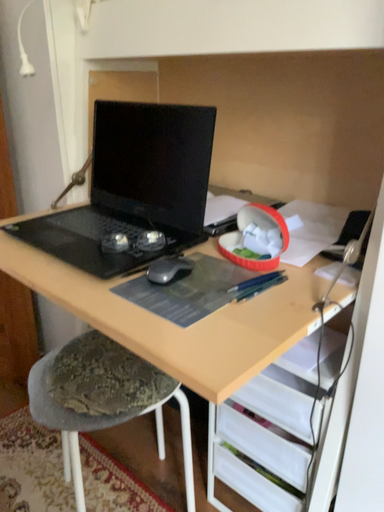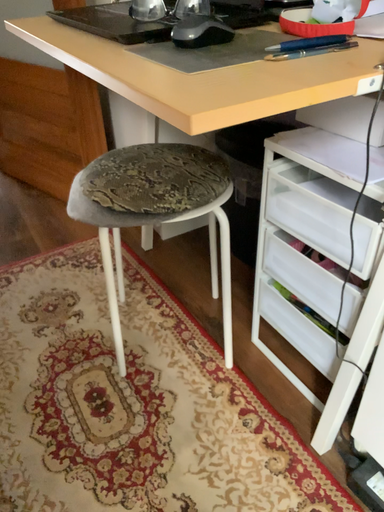
Question: How did the camera likely rotate when shooting the video?

Choices:
 (A) rotated downward
 (B) rotated upward

Answer: (A)